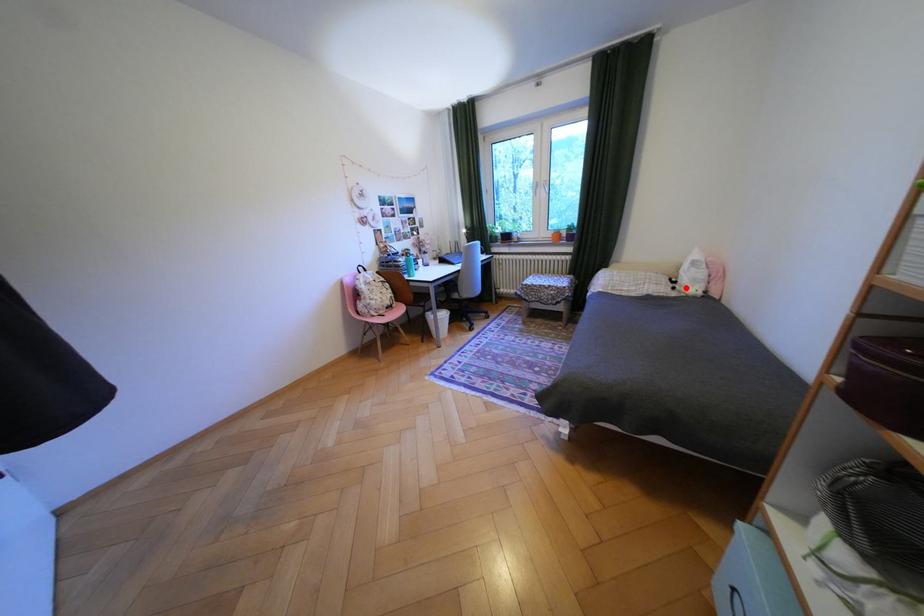
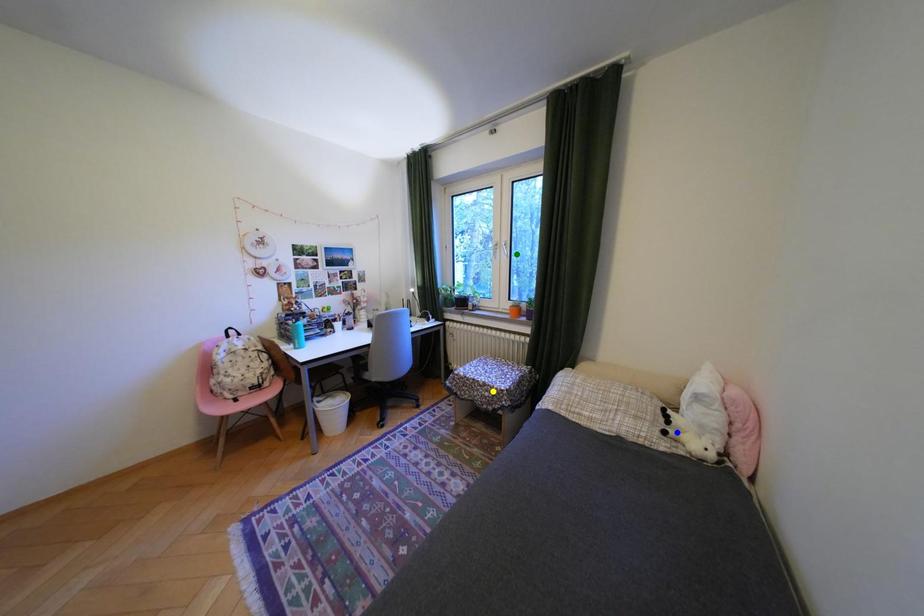
Question: I am providing you with two images of the same scene from different viewpoints. A red point is marked on the first image. You are given multiple points on the second image. Can you choose the point in image 2 that corresponds to the point in image 1?

Choices:
 (A) yellow point
 (B) green point
 (C) blue point

Answer: (C)